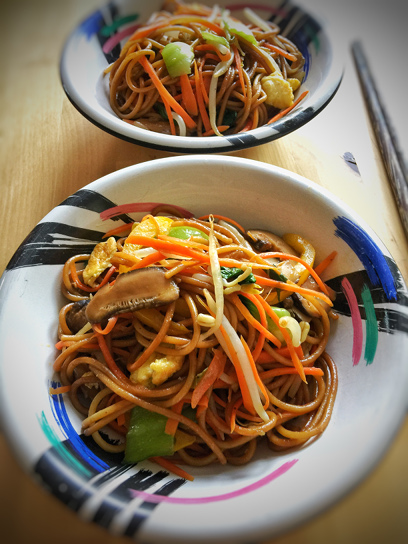
Locate an element on the screen. wooden tabletop is located at coordinates 41,172.